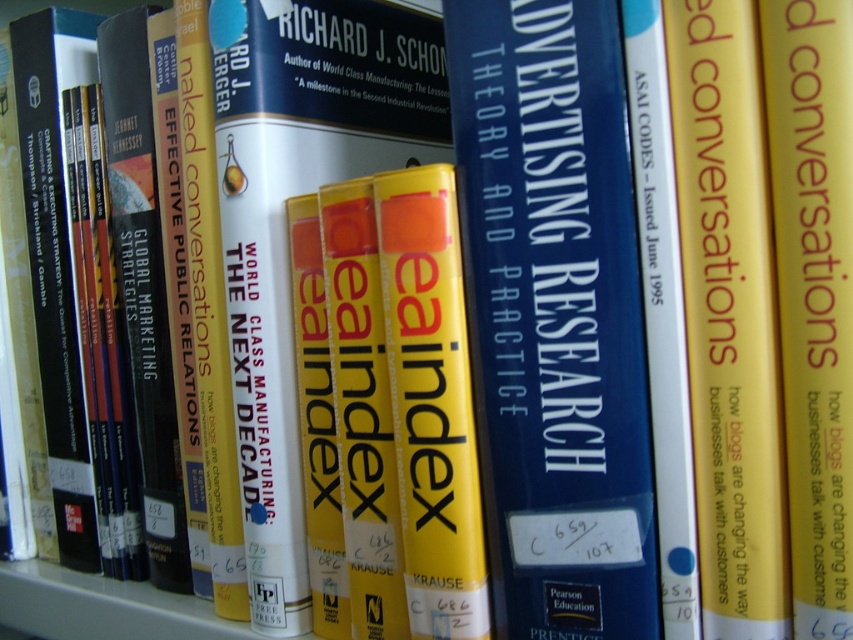
Question: Among these points, which one is nearest to the camera?

Choices:
 (A) (231, 22)
 (B) (570, 497)

Answer: (B)

Question: Can you confirm if blue hardcover book at center is wider than hardcover book at center?

Choices:
 (A) no
 (B) yes

Answer: (A)

Question: Which point is farther to the camera?

Choices:
 (A) hardcover book at center
 (B) blue hardcover book at center

Answer: (A)

Question: Does blue hardcover book at center have a smaller size compared to hardcover book at center?

Choices:
 (A) no
 (B) yes

Answer: (B)

Question: Among these objects, which one is farthest from the camera?

Choices:
 (A) blue hardcover book at center
 (B) hardcover book at center

Answer: (B)

Question: Observing the image, what is the correct spatial positioning of blue hardcover book at center in reference to hardcover book at center?

Choices:
 (A) right
 (B) left

Answer: (A)